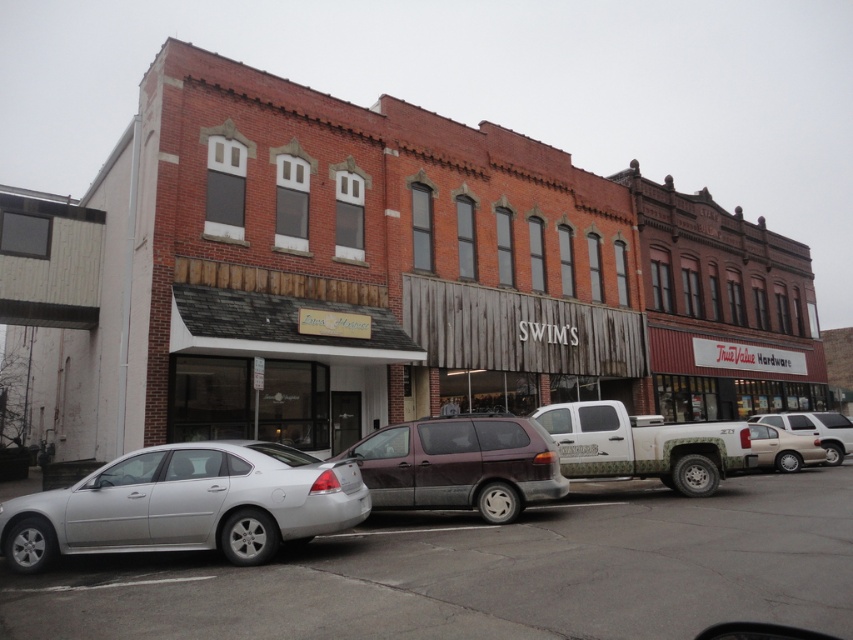
Between point (772, 481) and point (479, 490), which one is positioned behind?

The point (772, 481) is more distant.

Does point (151, 632) come behind point (432, 483)?

That is False.

Measure the distance between point (790,499) and camera.

Point (790,499) and camera are 12.27 meters apart from each other.

Where is `silver metallic car at lower left`? This screenshot has height=640, width=853. silver metallic car at lower left is located at coordinates (489, 572).

Is camouflage-patterned truck at center thinner than silver metallic sedan at right?

Indeed, camouflage-patterned truck at center has a lesser width compared to silver metallic sedan at right.

Can you confirm if camouflage-patterned truck at center is positioned to the right of silver metallic sedan at right?

In fact, camouflage-patterned truck at center is to the left of silver metallic sedan at right.

Describe the element at coordinates (643, 445) in the screenshot. I see `camouflage-patterned truck at center` at that location.

The height and width of the screenshot is (640, 853). Identify the location of camouflage-patterned truck at center. (643, 445).

How distant is silver metallic sedan at lower left from satin burgundy minivan at center?

silver metallic sedan at lower left and satin burgundy minivan at center are 2.60 meters apart.

What do you see at coordinates (187, 504) in the screenshot? The height and width of the screenshot is (640, 853). I see `silver metallic sedan at lower left` at bounding box center [187, 504].

This screenshot has width=853, height=640. I want to click on silver metallic sedan at lower left, so click(187, 504).